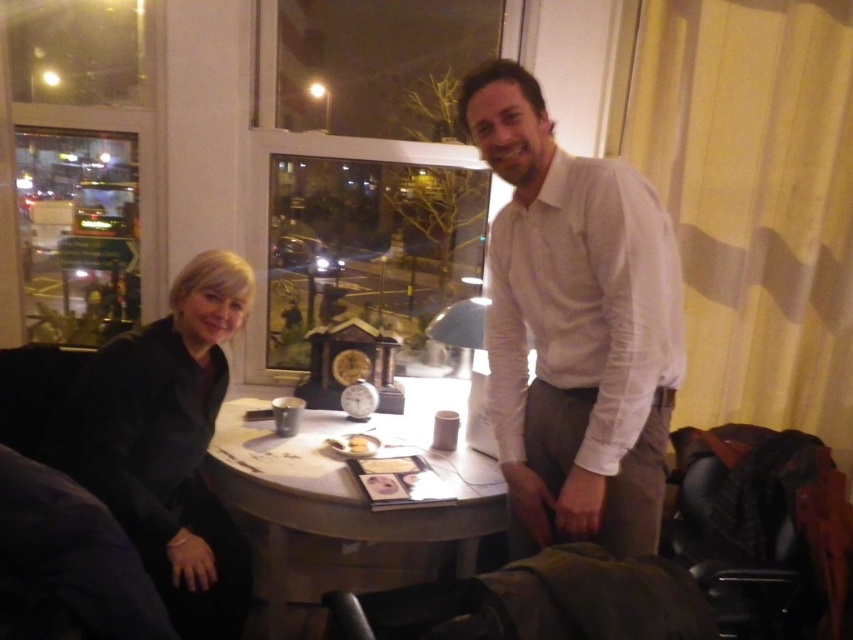
Question: Does transparent glass window at upper center appear on the left side of white wood round table at center?

Choices:
 (A) yes
 (B) no

Answer: (A)

Question: Which point is farther to the camera?

Choices:
 (A) (624, 429)
 (B) (210, 536)
 (C) (311, 140)
 (D) (392, 596)

Answer: (C)

Question: Is white cotton shirt at center bigger than white wood round table at center?

Choices:
 (A) yes
 (B) no

Answer: (B)

Question: Which object is farther from the camera taking this photo?

Choices:
 (A) brown leather bag at lower center
 (B) white cotton shirt at center
 (C) black matte jacket at lower left

Answer: (C)

Question: Observing the image, what is the correct spatial positioning of transparent glass window at upper center in reference to brown leather bag at lower center?

Choices:
 (A) right
 (B) left

Answer: (B)

Question: Among these points, which one is farthest from the camera?

Choices:
 (A) (279, 588)
 (B) (540, 97)

Answer: (A)